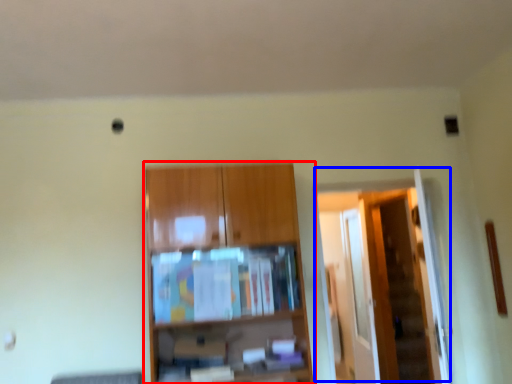
Question: Which of the following is the farthest to the observer, cupboard (highlighted by a red box) or door (highlighted by a blue box)?

Choices:
 (A) cupboard
 (B) door

Answer: (B)